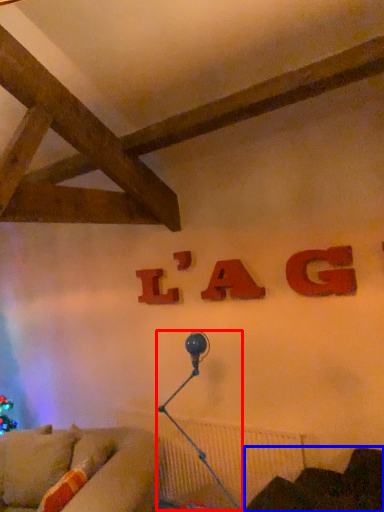
Question: Which point is closer to the camera, lamp (highlighted by a red box) or furniture (highlighted by a blue box)?

Choices:
 (A) lamp
 (B) furniture

Answer: (B)